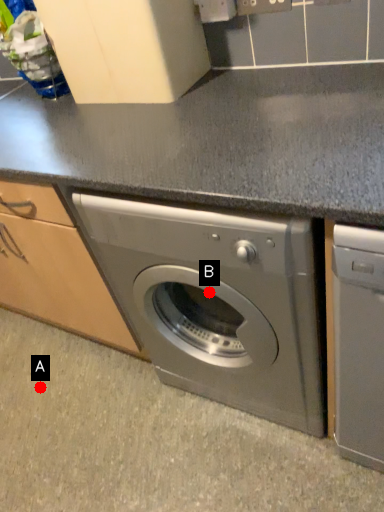
Question: Two points are circled on the image, labeled by A and B beside each circle. Which point is closer to the camera?

Choices:
 (A) A is closer
 (B) B is closer

Answer: (B)